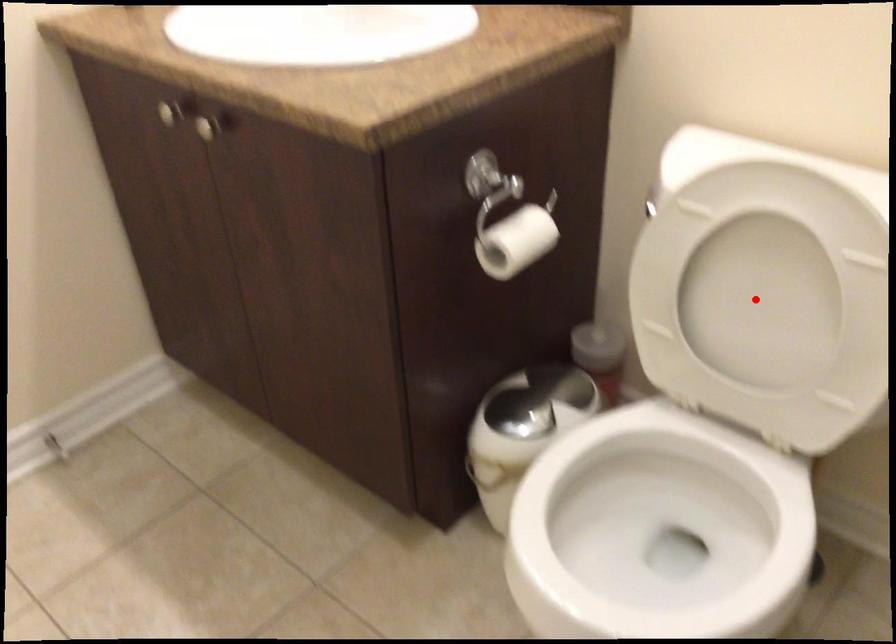
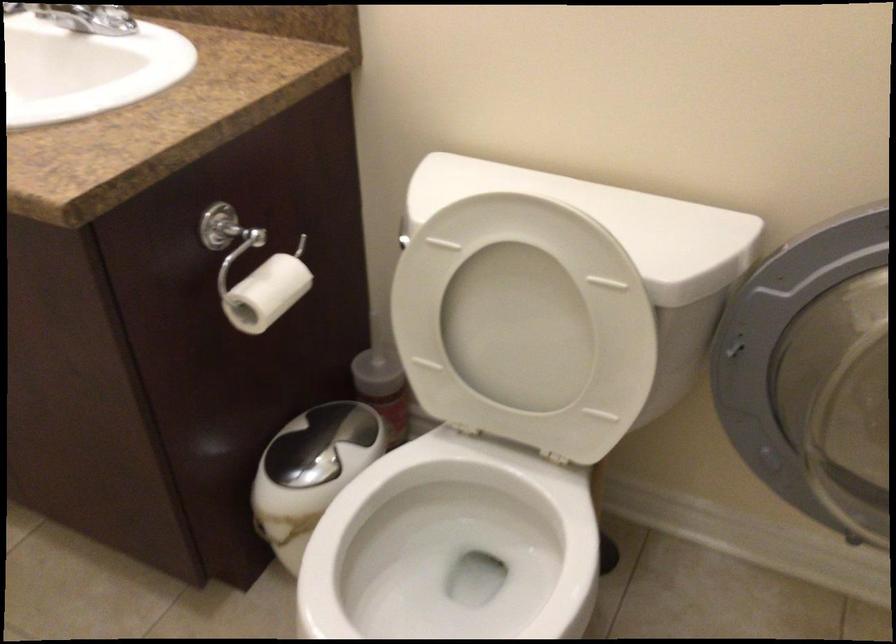
Where in the second image is the point corresponding to the highlighted location from the first image?

(517, 328)